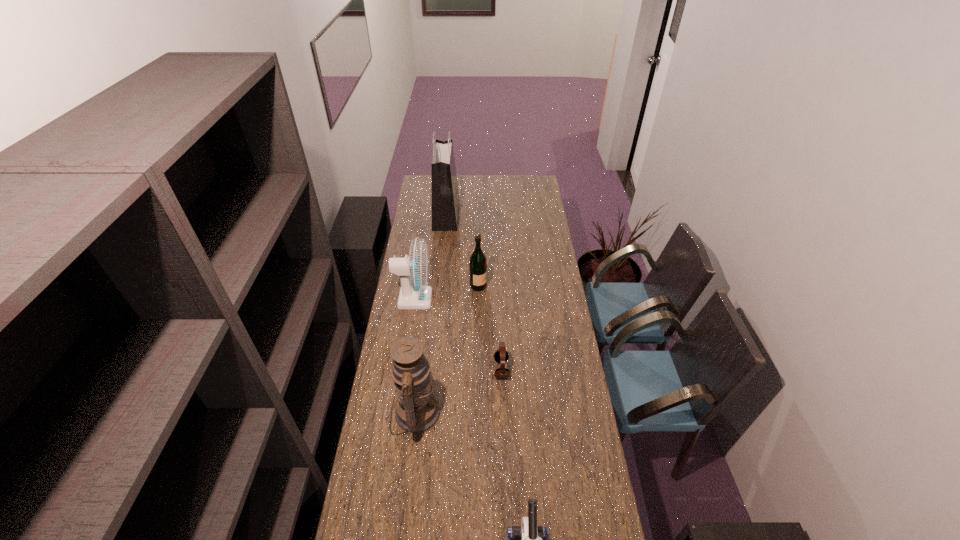
Where is `blank area in the image that satisfies the following two spatial constraints: 1. in front of the fan to face the airflow; 2. on the left side of the fifth farthest object`? The width and height of the screenshot is (960, 540). blank area in the image that satisfies the following two spatial constraints: 1. in front of the fan to face the airflow; 2. on the left side of the fifth farthest object is located at coordinates (397, 413).

This screenshot has height=540, width=960. In order to click on free space in the image that satisfies the following two spatial constraints: 1. in front of the oil lamp to face the airflow; 2. on the right side of the fan in this screenshot , I will do `click(397, 413)`.

The width and height of the screenshot is (960, 540). In order to click on vacant space that satisfies the following two spatial constraints: 1. on the back side of the second tallest object; 2. in front of the fan to face the airflow in this screenshot , I will do `click(428, 299)`.